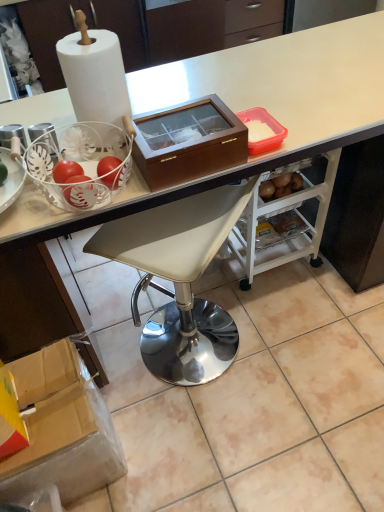
You are a GUI agent. You are given a task and a screenshot of the screen. Output one action in this format:
    pyautogui.click(x=<x>, y=<y>)
    Task: Click on the vacant area that lies between white leather stool at center and white glossy desk at upper center
    The width and height of the screenshot is (384, 512).
    Given the screenshot: What is the action you would take?
    pyautogui.click(x=268, y=355)